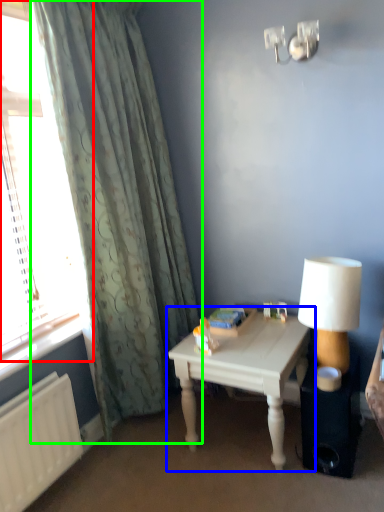
Question: Which object is positioned closest to window (highlighted by a red box)? Select from table (highlighted by a blue box) and curtain (highlighted by a green box).

Choices:
 (A) table
 (B) curtain

Answer: (B)